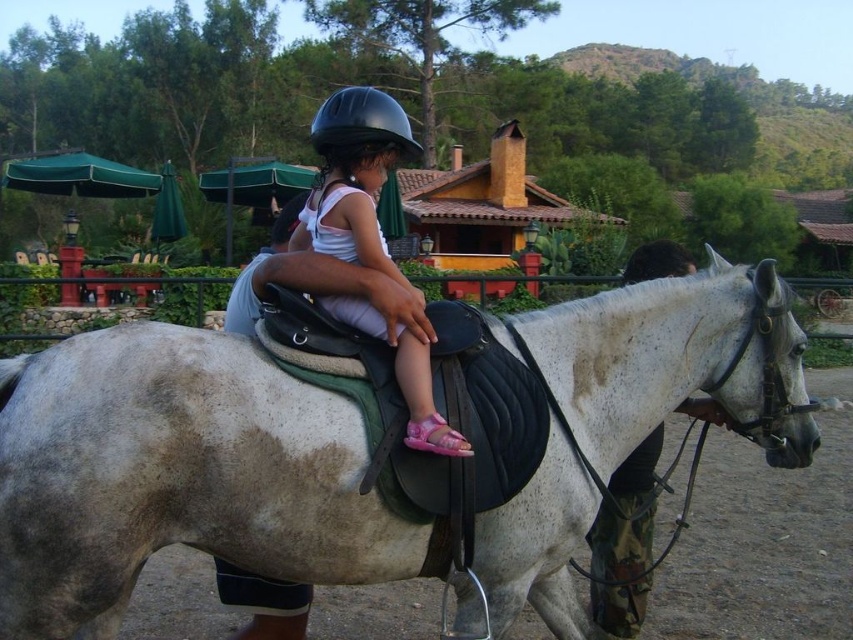
Does matte black helmet at center have a greater height compared to black matte helmet at center?

No.

Is point (343, 109) closer to viewer compared to point (415, 148)?

That is True.

Between point (338, 144) and point (399, 128), which one is positioned behind?

The point (338, 144) is behind.

In order to click on matte black helmet at center in this screenshot , I will do `click(354, 177)`.

Can you confirm if white matte horse at center is smaller than matte black helmet at center?

Actually, white matte horse at center might be larger than matte black helmet at center.

Does white matte horse at center have a lesser width compared to matte black helmet at center?

Incorrect, white matte horse at center's width is not less than matte black helmet at center's.

The image size is (853, 640). What are the coordinates of `white matte horse at center` in the screenshot? It's located at (175, 476).

This screenshot has height=640, width=853. In order to click on white matte horse at center in this screenshot , I will do `click(175, 476)`.

Is white matte horse at center in front of black matte helmet at center?

Yes, white matte horse at center is in front of black matte helmet at center.

Who is lower down, white matte horse at center or black matte helmet at center?

white matte horse at center is lower down.

Between point (122, 541) and point (364, 125), which one is positioned in front?

Positioned in front is point (122, 541).

You are a GUI agent. You are given a task and a screenshot of the screen. Output one action in this format:
    pyautogui.click(x=<x>, y=<y>)
    Task: Click on the white matte horse at center
    Image resolution: width=853 pixels, height=640 pixels.
    Given the screenshot: What is the action you would take?
    pyautogui.click(x=175, y=476)